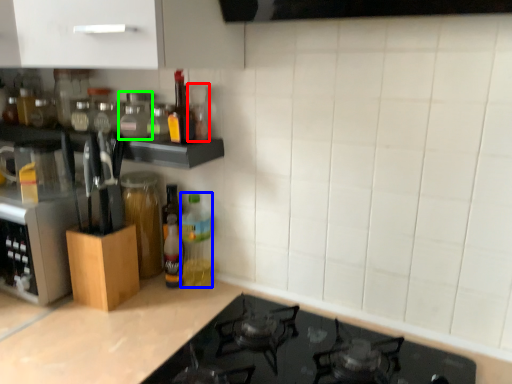
Question: Based on their relative distances, which object is nearer to bottle (highlighted by a red box)? Choose from bottle (highlighted by a blue box) and bottle (highlighted by a green box).

Choices:
 (A) bottle
 (B) bottle

Answer: (B)